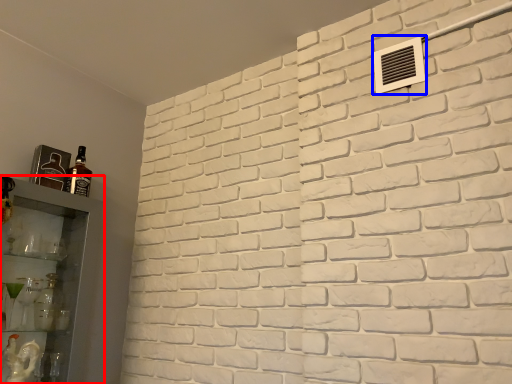
Question: Which point is further to the camera, shelf (highlighted by a red box) or air conditioning (highlighted by a blue box)?

Choices:
 (A) shelf
 (B) air conditioning

Answer: (B)